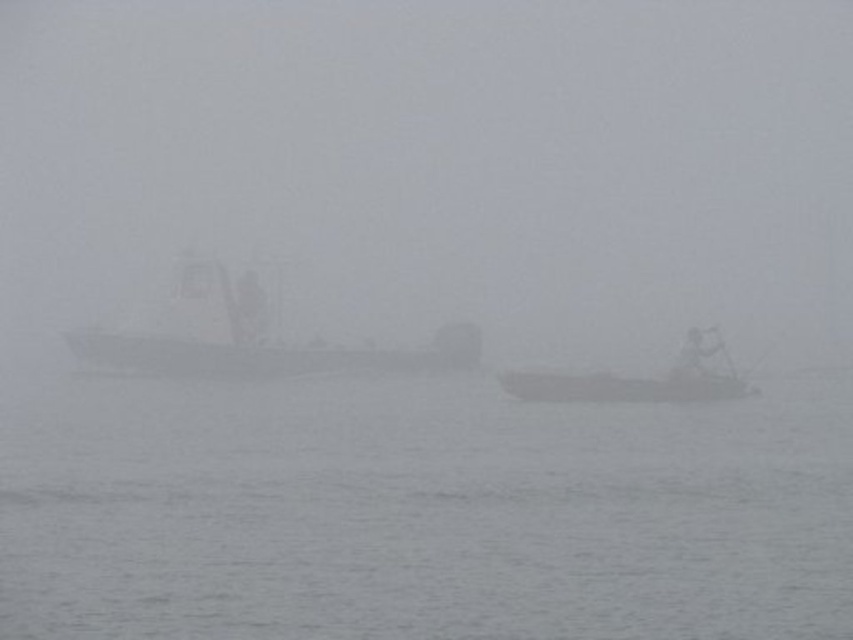
Question: Which of these objects is positioned closest to the gray water at center?

Choices:
 (A) foggy gray sea at center
 (B) smooth white boat at center
 (C) smooth gray boat at center

Answer: (B)

Question: Can you confirm if gray water at center is positioned to the right of smooth white boat at center?

Choices:
 (A) yes
 (B) no

Answer: (B)

Question: Can you confirm if gray water at center is positioned below smooth gray boat at center?

Choices:
 (A) yes
 (B) no

Answer: (A)

Question: Estimate the real-world distances between objects in this image. Which object is closer to the gray water at center?

Choices:
 (A) smooth gray boat at center
 (B) foggy gray sea at center

Answer: (A)

Question: Can you confirm if smooth gray boat at center is bigger than smooth white boat at center?

Choices:
 (A) yes
 (B) no

Answer: (A)

Question: Which object appears farthest from the camera in this image?

Choices:
 (A) smooth white boat at center
 (B) foggy gray sea at center
 (C) gray water at center

Answer: (B)